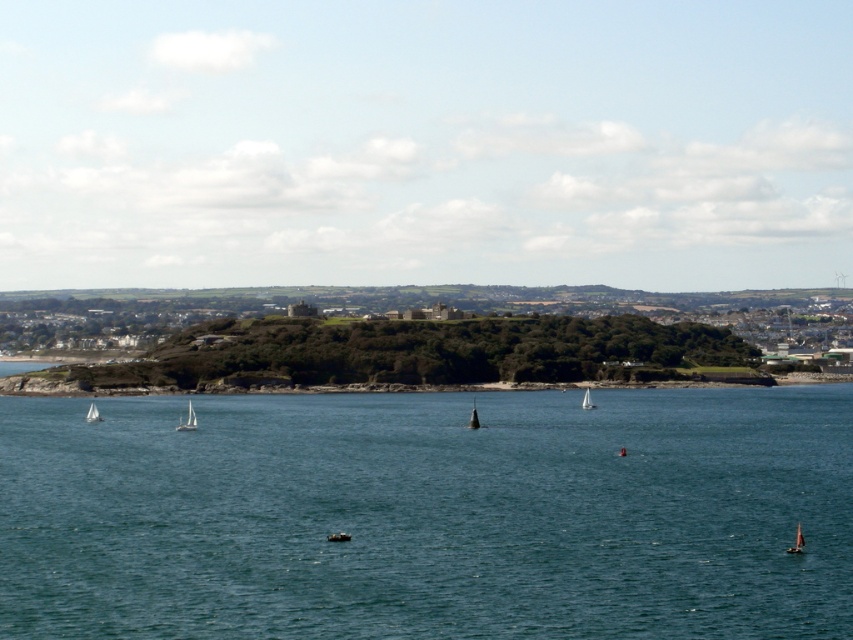
You are standing at the edge of the coastal landscape looking out toward the horizon. There are two points marked on the image, one at coordinates point (222, 547) and another at point (86, 417). Which of these two points is located closer to you?

Point (222, 547) is closer to the viewer than point (86, 417).

You are standing on the dock and see the white matte sailboat at center left. If you want to reach the point at coordinates (187, 420), which object should you head towards?

You should head towards the white matte sailboat at center left because the point at coordinates (187, 420) corresponds to it.